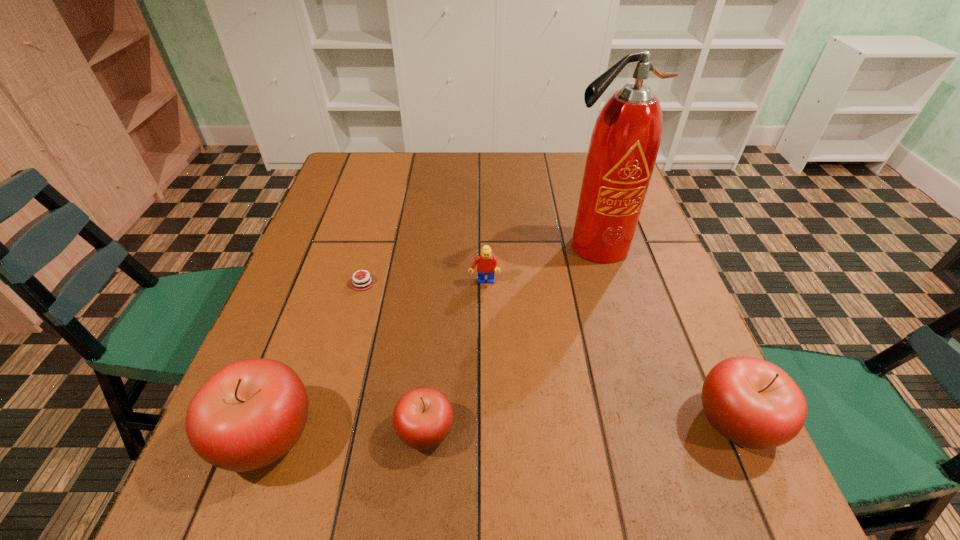
Locate an element on the screen. The width and height of the screenshot is (960, 540). blank area located on the left of the second tallest apple is located at coordinates (558, 421).

Identify the location of vacant area situated 0.070m on the front-facing side of the fourth object from left to right. (485, 310).

Identify the location of vacant space situated on the front of the tallest object. The height and width of the screenshot is (540, 960). (623, 343).

Locate an element on the screen. This screenshot has height=540, width=960. vacant space located 0.390m on the back of the shortest object is located at coordinates (391, 177).

Where is `apple positioned at the left edge`? apple positioned at the left edge is located at coordinates (250, 413).

This screenshot has width=960, height=540. In order to click on chocolate cake located in the left edge section of the desktop in this screenshot , I will do `click(366, 281)`.

I want to click on apple that is at the right edge, so click(x=754, y=403).

Find the location of `fire extinguisher at the right edge`. fire extinguisher at the right edge is located at coordinates (624, 144).

The width and height of the screenshot is (960, 540). Find the location of `object that is at the near left corner`. object that is at the near left corner is located at coordinates tap(250, 413).

This screenshot has height=540, width=960. In order to click on object that is positioned at the near right corner in this screenshot , I will do `click(754, 403)`.